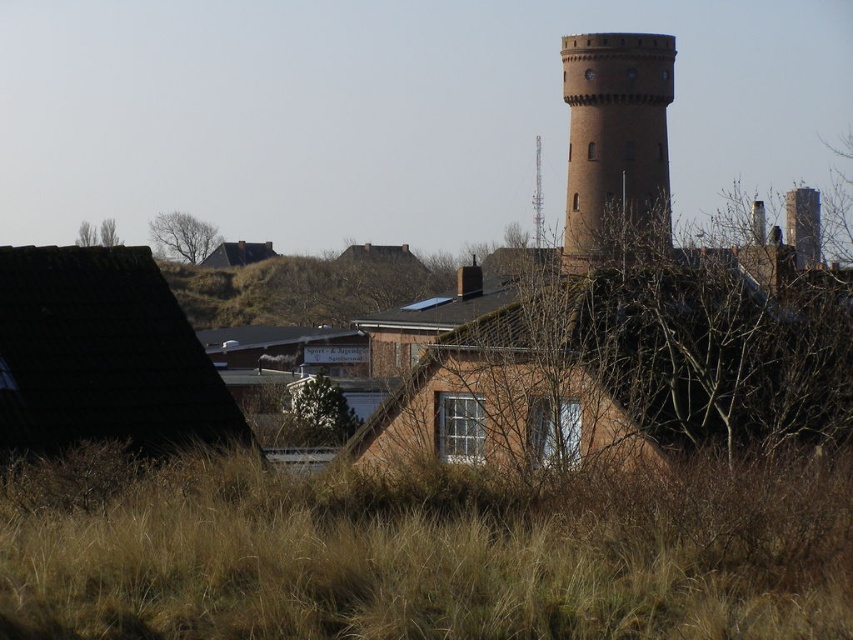
Does green leafy tree at center appear over brown leafless tree at left?

Actually, green leafy tree at center is below brown leafless tree at left.

Can you confirm if green leafy tree at center is bigger than brown leafless tree at left?

No, green leafy tree at center is not bigger than brown leafless tree at left.

Which is behind, point (289, 420) or point (112, 230)?

The point (112, 230) is more distant.

This screenshot has height=640, width=853. Identify the location of green leafy tree at center. (321, 412).

Between point (155, 216) and point (791, 200), which one is positioned in front?

Point (791, 200)

Is bare branches at upper left smaller than brown brick tower at upper center?

Indeed, bare branches at upper left has a smaller size compared to brown brick tower at upper center.

Between point (212, 241) and point (805, 196), which one is positioned behind?

The point (212, 241) is more distant.

Locate an element on the screen. The height and width of the screenshot is (640, 853). bare branches at upper left is located at coordinates (183, 236).

Who is positioned more to the left, brick tower at upper center or bare branches at upper left?

bare branches at upper left is more to the left.

Is point (628, 36) positioned before point (172, 220)?

Yes, point (628, 36) is closer to viewer.

In order to click on brick tower at upper center in this screenshot , I will do `click(614, 141)`.